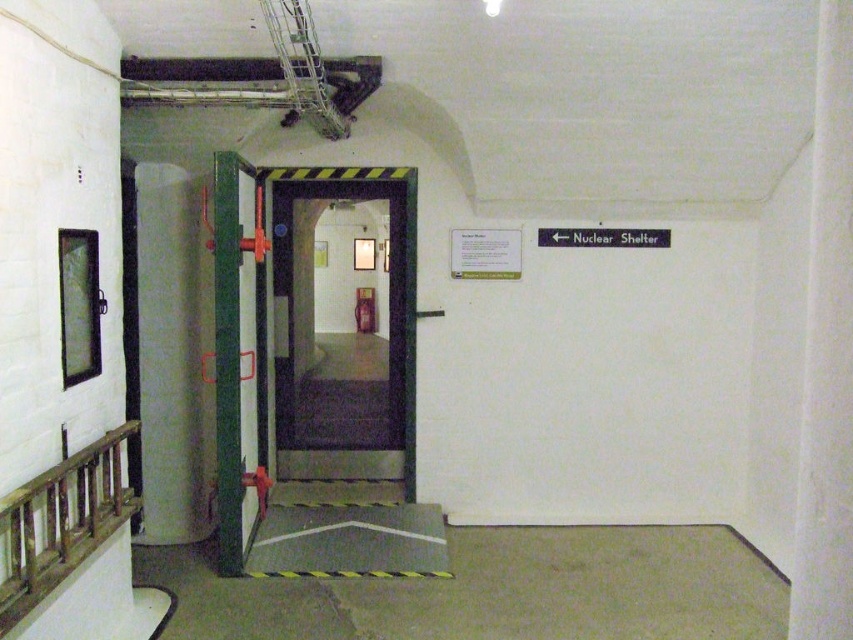
You are an emergency responder entering the nuclear shelter. You need to locate the wooden at left. Where should you look relative to the green matte door at center?

The wooden at left is behind the green matte door at center, so you should open the door and look behind it to find the wooden at left.

You are a maintenance worker needing to inspect the green matte door at center. Your tool kit is 2 meters long. If you place the tool kit horizontally on the floor, will it reach the door from your current position?

The green matte door at center is 3.84 meters away from the camera. Since the tool kit is only 2 meters long, it will not reach the door from your current position.

You are a maintenance worker needing to replace a broken window. The green matte door at center has a window on its left side, and there is a wooden at left nearby. Which object has a window that you need to replace?

The green matte door at center has a window on its left side that needs replacement since the wooden at left does not have a window mentioned in the scene.